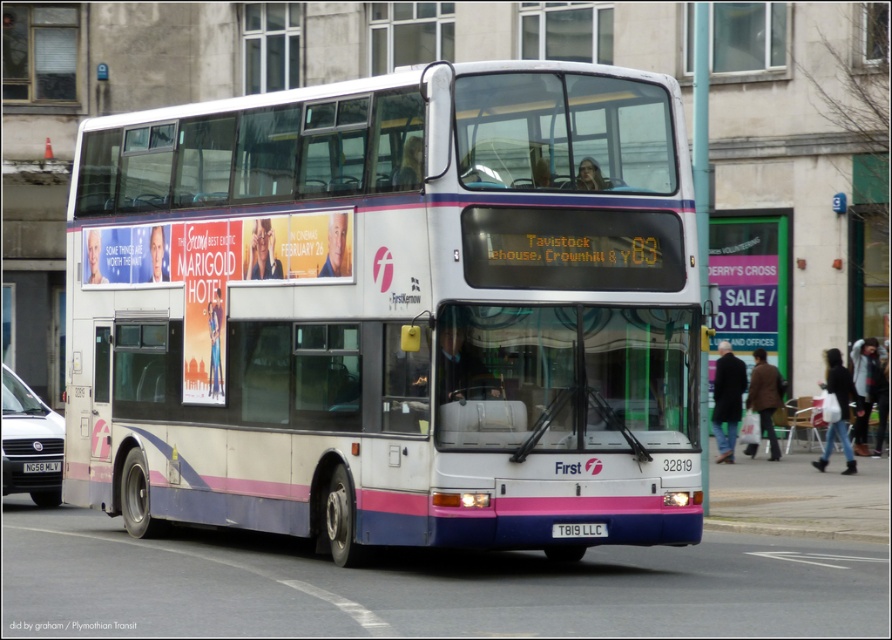
Can you confirm if white matte/deck bus at center is positioned to the right of black plastic license plate at center?

Yes, white matte/deck bus at center is to the right of black plastic license plate at center.

Is point (217, 385) farther from camera compared to point (44, 470)?

No.

Where is `white matte/deck bus at center`? The width and height of the screenshot is (892, 640). white matte/deck bus at center is located at coordinates pos(392,310).

Locate an element on the screen. white matte/deck bus at center is located at coordinates (392, 310).

Does white matte/deck bus at center have a larger size compared to white plastic license plate at center?

Yes, white matte/deck bus at center is bigger than white plastic license plate at center.

Describe the element at coordinates (392, 310) in the screenshot. Image resolution: width=892 pixels, height=640 pixels. I see `white matte/deck bus at center` at that location.

This screenshot has height=640, width=892. What are the coordinates of `white matte/deck bus at center` in the screenshot? It's located at (392, 310).

What do you see at coordinates (579, 529) in the screenshot? This screenshot has width=892, height=640. I see `white plastic license plate at center` at bounding box center [579, 529].

Which is in front, point (577, 529) or point (32, 472)?

Point (577, 529)

This screenshot has height=640, width=892. I want to click on white plastic license plate at center, so click(x=579, y=529).